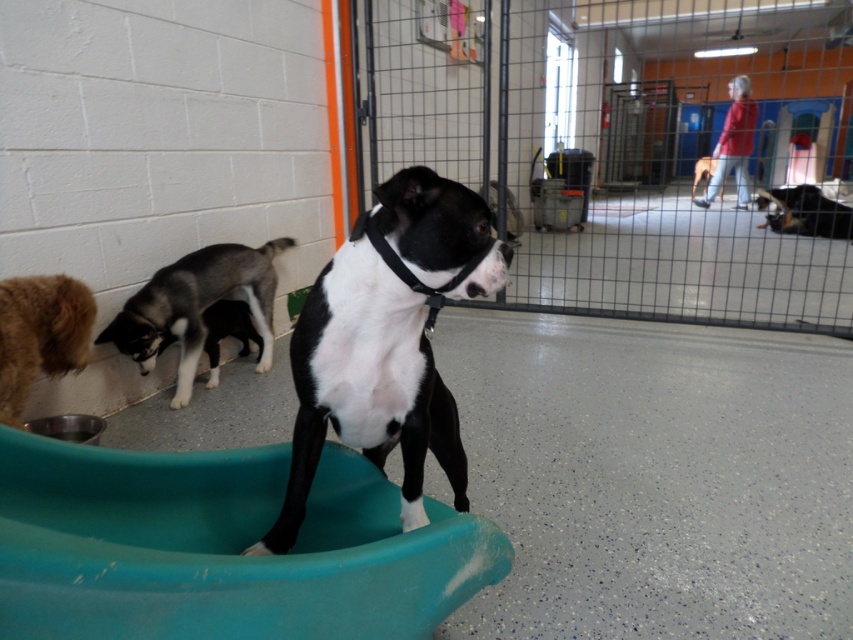
You are standing in the kennel and want to take a photo of the black and white dog in the teal tub. The camera you are using has a focal length of 50mm. To ensure the dog is in focus, you need to adjust the focus ring to the distance of the point at coordinates point [368,326]. What distance should you set the focus ring to?

The point at coordinates point [368,326] is 3.88 feet away from the camera, so you should set the focus ring to 3.88 feet to ensure the black and white dog in the teal tub is in focus.

You are a volunteer at the animal shelter and need to clean the kennel. You see the gray fur dog at lower left and the black glossy dog at upper right. Which dog is located below the other?

The gray fur dog at lower left is positioned under the black glossy dog at upper right.